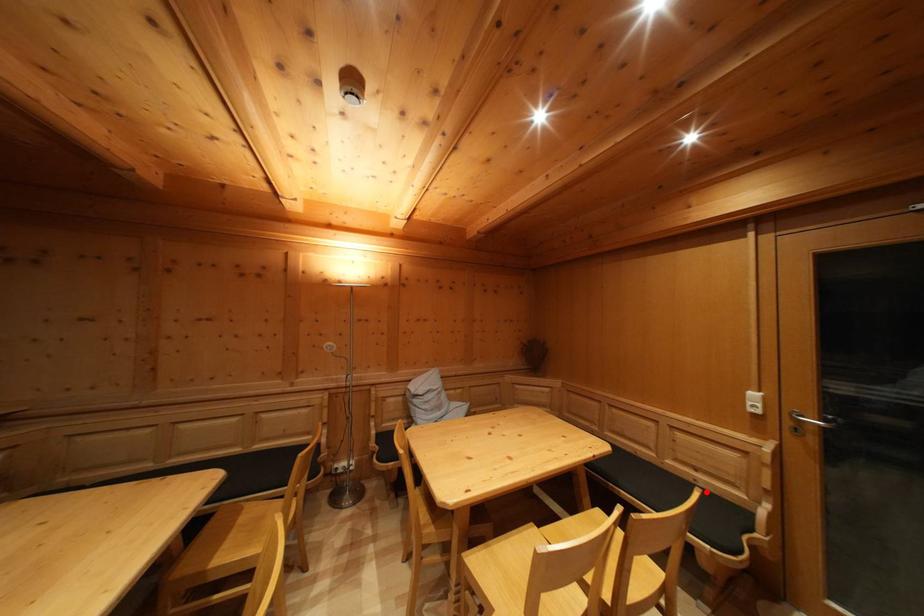
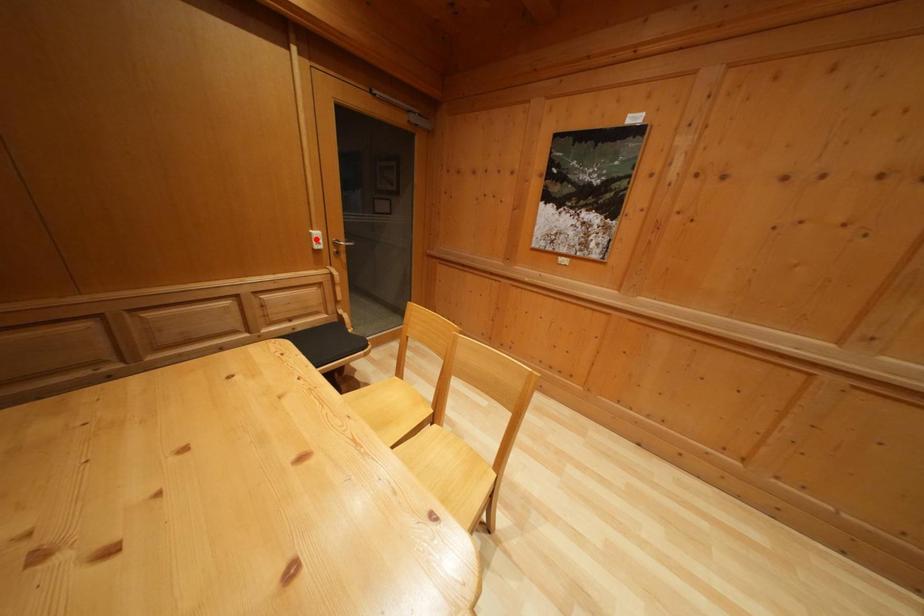
I am providing you with two images of the same scene from different viewpoints. A red point is marked on the first image and another point is marked on the second image. Is the marked point in image1 the same physical position as the marked point in image2?

No